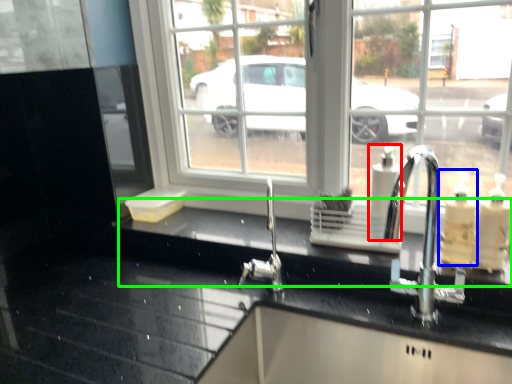
Question: Which object is positioned farthest from soap dispenser (highlighted by a red box)? Select from soap dispenser (highlighted by a blue box) and counter top (highlighted by a green box).

Choices:
 (A) soap dispenser
 (B) counter top

Answer: (B)